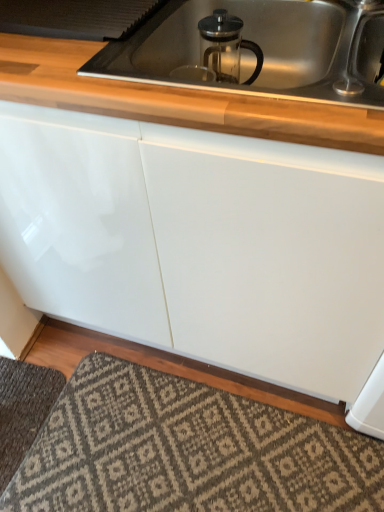
This screenshot has width=384, height=512. In order to click on vacant space in dark gray textured rug at lower left, the 2th doormat from the right (from a real-world perspective) in this screenshot , I will do `click(19, 401)`.